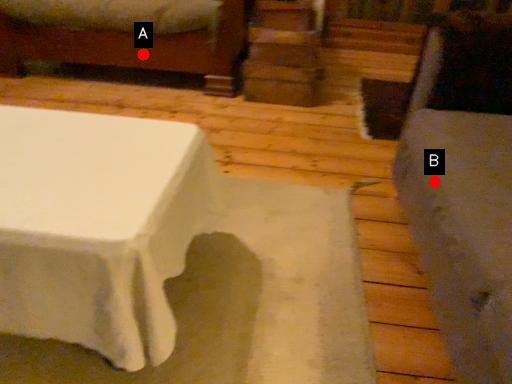
Question: Two points are circled on the image, labeled by A and B beside each circle. Among these points, which one is farthest from the camera?

Choices:
 (A) A is further
 (B) B is further

Answer: (A)